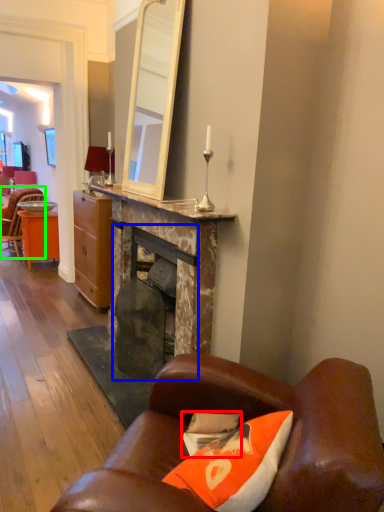
Question: Which is nearer to the pillow (highlighted by a red box)? fireplace (highlighted by a blue box) or chair (highlighted by a green box).

Choices:
 (A) fireplace
 (B) chair

Answer: (A)